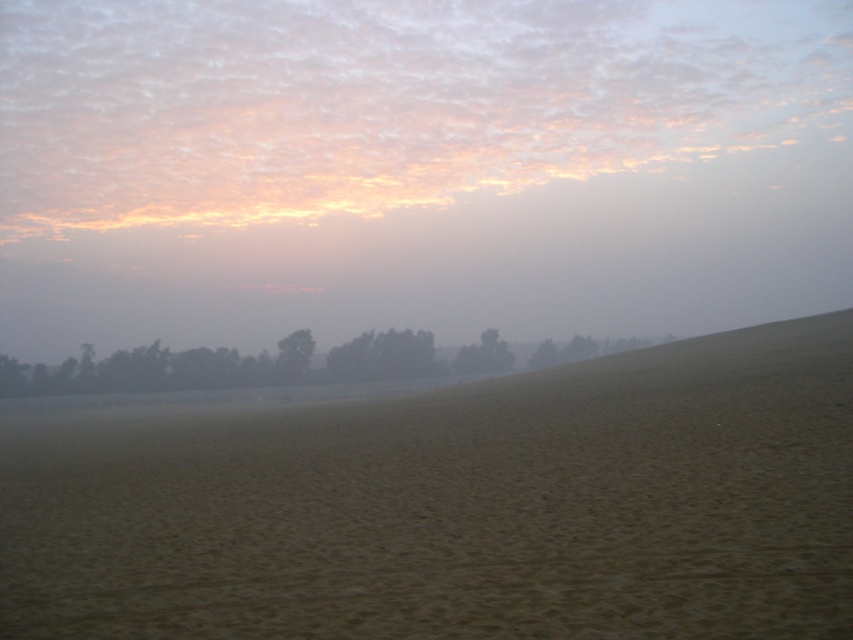
You are standing on the sand in the scene and want to walk towards the dark green trees at lower center. Which direction should you move to reach them from the foggy sand at lower center?

The foggy sand at lower center is located above the dark green trees at lower center, so you should move downward to reach the dark green trees at lower center.

You are standing in the desert scene and want to walk towards the green matte tree at center. Which direction should you move relative to the foggy sand at lower center?

You should move away from the foggy sand at lower center because the green matte tree at center is behind it, further away from you.